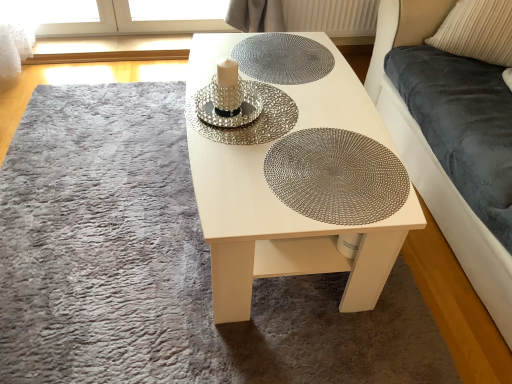
Question: In terms of size, does white textured radiator at upper center appear bigger or smaller than velvet dark blue couch at right?

Choices:
 (A) big
 (B) small

Answer: (B)

Question: Would you say white textured radiator at upper center is inside or outside velvet dark blue couch at right?

Choices:
 (A) inside
 (B) outside

Answer: (B)

Question: Which object is the farthest from the metallic woven placemat at center, marked as the 1th glass plate in a bottom-to-top arrangement?

Choices:
 (A) white textured mat at center
 (B) velvet dark blue couch at right
 (C) white textured radiator at upper center
 (D) white wood table at center
 (E) silver metallic plate at center, arranged as the second glass plate when ordered from the bottom

Answer: (C)

Question: Which object is the closest to the beige corduroy pillow at upper right?

Choices:
 (A) white textured mat at center
 (B) velvet dark blue couch at right
 (C) white wood table at center
 (D) silver metallic plate at center, the second glass plate from the top
 (E) metallic textured glass plate at center, which ranks as the 3th glass plate in bottom-to-top order

Answer: (B)